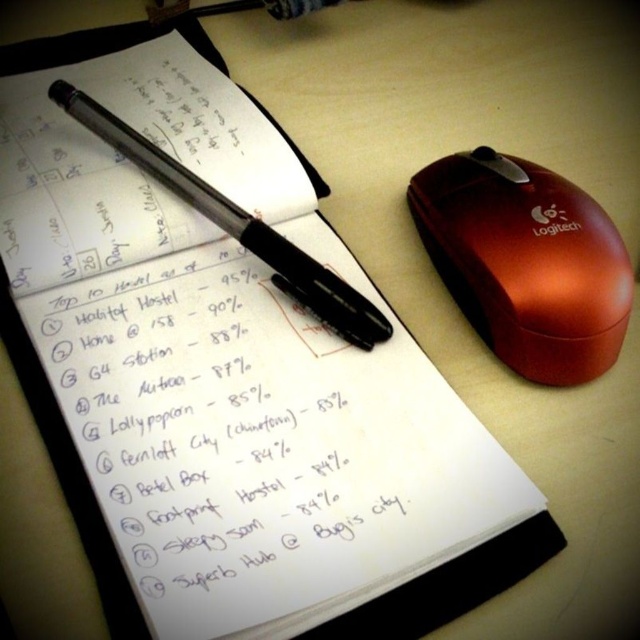
Which is behind, point (557, 248) or point (93, 120)?

The point (93, 120) is more distant.

Can you confirm if shiny red mouse at right is positioned above black glossy pen at upper left?

Actually, shiny red mouse at right is below black glossy pen at upper left.

This screenshot has width=640, height=640. In order to click on shiny red mouse at right in this screenshot , I will do `click(525, 262)`.

Looking at this image, does white handwritten text at center come in front of shiny red mouse at right?

Yes, white handwritten text at center is closer to the viewer.

Is white handwritten text at center above shiny red mouse at right?

Actually, white handwritten text at center is below shiny red mouse at right.

The height and width of the screenshot is (640, 640). I want to click on white handwritten text at center, so click(225, 428).

Measure the distance from white handwritten text at center to black glossy pen at upper left.

white handwritten text at center and black glossy pen at upper left are 5.90 inches apart.

Locate an element on the screen. white handwritten text at center is located at coordinates click(x=225, y=428).